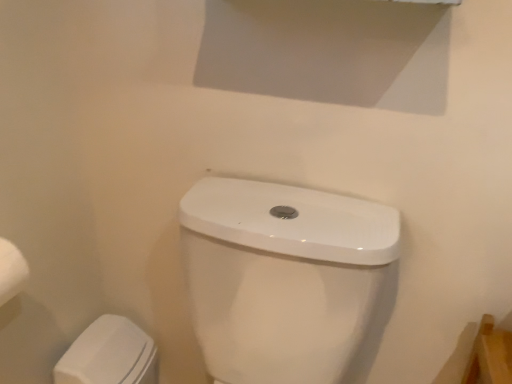
The width and height of the screenshot is (512, 384). What are the coordinates of `vacant area on top of white glossy porcelain at lower left (from a real-world perspective)` in the screenshot? It's located at (98, 340).